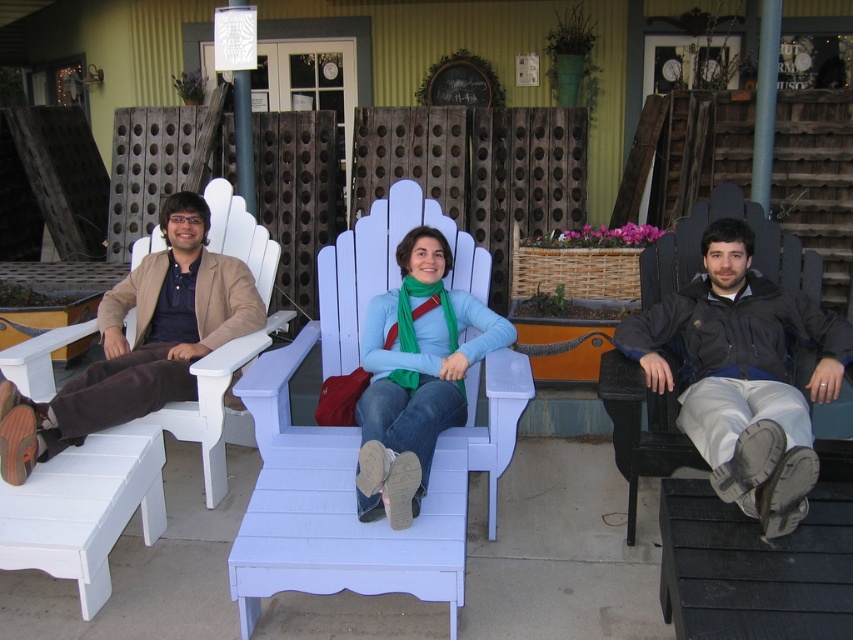
Question: Which point is farther to the camera?

Choices:
 (A) (415, 380)
 (B) (433, 540)
 (C) (717, 493)
 (D) (213, 256)

Answer: (D)

Question: Estimate the real-world distances between objects in this image. Which object is closer to the white wood chair at center?

Choices:
 (A) matte brown jacket at left
 (B) matte green scarf at center
 (C) dark gray jacket at right

Answer: (B)

Question: Which point is closer to the camera?

Choices:
 (A) white wood chair at center
 (B) matte green scarf at center
 (C) matte brown jacket at left
 (D) dark gray jacket at right

Answer: (D)

Question: Does dark gray jacket at right appear on the right side of matte green scarf at center?

Choices:
 (A) no
 (B) yes

Answer: (B)

Question: Does dark gray jacket at right appear on the left side of matte green scarf at center?

Choices:
 (A) yes
 (B) no

Answer: (B)

Question: Can you confirm if dark gray jacket at right is thinner than matte green scarf at center?

Choices:
 (A) no
 (B) yes

Answer: (A)